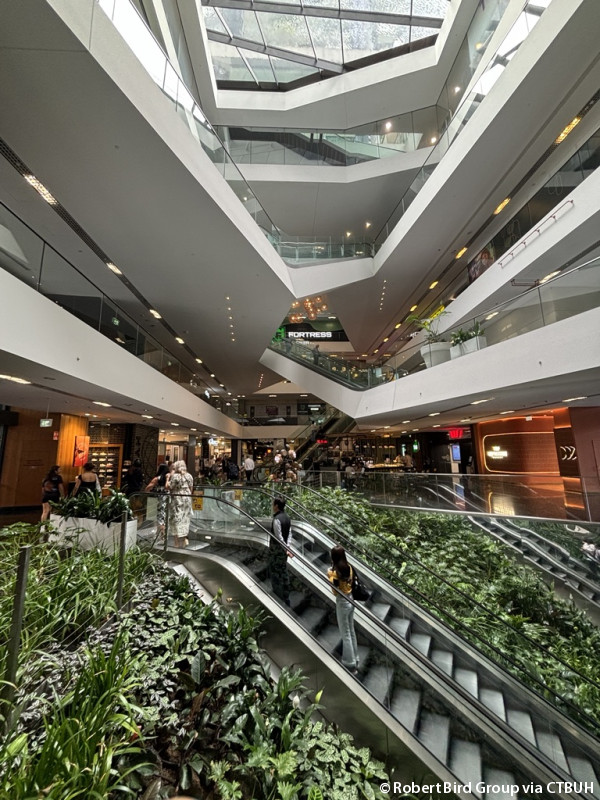
Where is `glass bannister at top of escaltor`? glass bannister at top of escaltor is located at coordinates (232, 537), (244, 508), (304, 492), (287, 501), (454, 500), (467, 488).